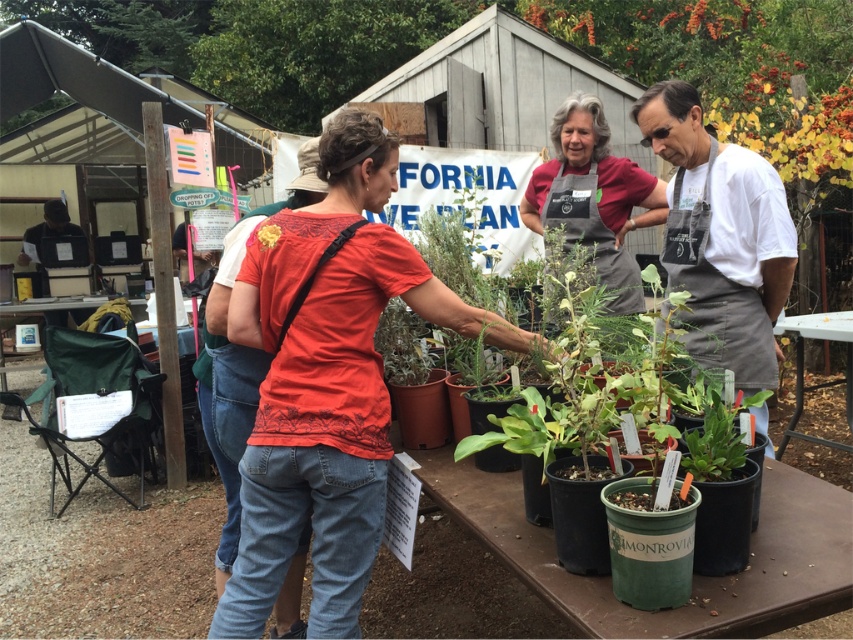
Question: Does matte red shirt at center appear on the left side of matte gray apron at center?

Choices:
 (A) yes
 (B) no

Answer: (A)

Question: Does white apron at center have a greater width compared to matte gray apron at center?

Choices:
 (A) no
 (B) yes

Answer: (A)

Question: Is white apron at center positioned before matte gray apron at center?

Choices:
 (A) no
 (B) yes

Answer: (B)

Question: Which object is positioned closest to the denim jeans at center?

Choices:
 (A) white apron at center
 (B) yellow fabric flower at center
 (C) matte gray apron at center
 (D) matte red shirt at center

Answer: (D)

Question: Which point is closer to the camera?

Choices:
 (A) (625, 273)
 (B) (260, 237)
 (C) (234, 576)

Answer: (B)

Question: Estimate the real-world distances between objects in this image. Which object is closer to the yellow fabric flower at center?

Choices:
 (A) matte red shirt at center
 (B) denim jeans at center
 (C) white apron at center

Answer: (A)